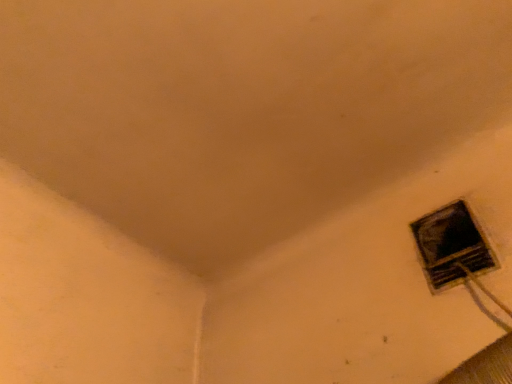
I want to click on matte black window at lower right, so click(452, 246).

What do you see at coordinates (452, 246) in the screenshot? I see `matte black window at lower right` at bounding box center [452, 246].

In order to click on matte black window at lower right in this screenshot , I will do `click(452, 246)`.